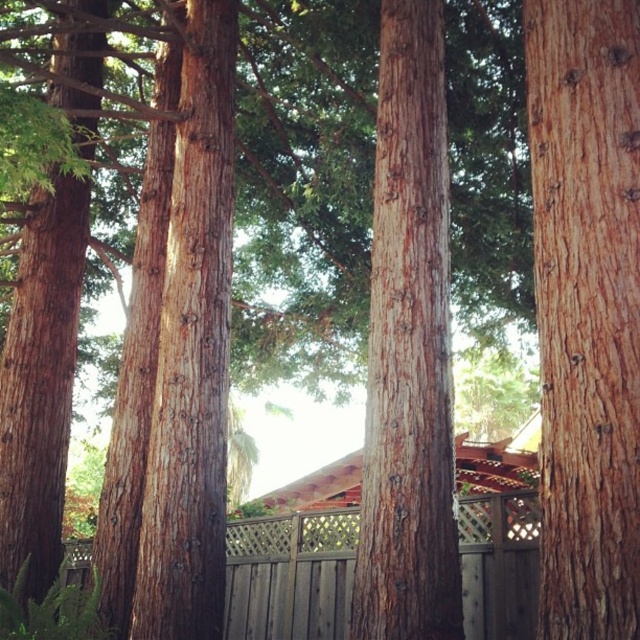
Between smooth brown bark at right and smooth brown tree trunk at center, which one is positioned lower?

Positioned lower is smooth brown bark at right.

Is smooth brown bark at right above smooth brown tree trunk at center?

No, smooth brown bark at right is not above smooth brown tree trunk at center.

At what (x,y) coordinates should I click in order to perform the action: click on smooth brown bark at right. Please return your answer as a coordinate pair (x, y). The width and height of the screenshot is (640, 640). Looking at the image, I should click on (586, 308).

Is brown textured wood at center to the left of smooth brown tree trunk at center from the viewer's perspective?

No, brown textured wood at center is not to the left of smooth brown tree trunk at center.

Does point (419, 177) lie in front of point (228, 332)?

Yes, point (419, 177) is closer to viewer.

Which is in front, point (444, 605) or point (164, 269)?

Point (444, 605) is more forward.

I want to click on brown textured wood at center, so click(x=408, y=349).

Does point (582, 362) come behind point (484, 624)?

No, (582, 362) is closer to viewer.

Who is more forward, (554, 609) or (317, 522)?

Point (554, 609) is in front.

The width and height of the screenshot is (640, 640). In order to click on smooth brown bark at right in this screenshot , I will do `click(586, 308)`.